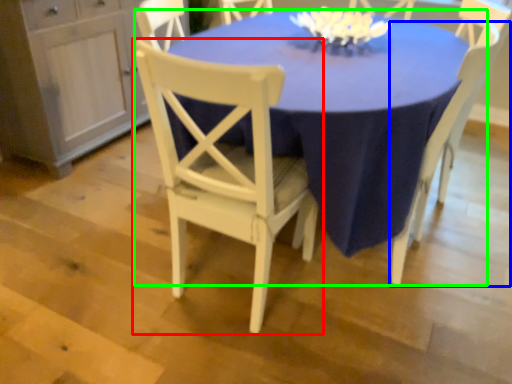
Question: Which object is positioned farthest from chair (highlighted by a red box)? Select from chair (highlighted by a blue box) and table (highlighted by a green box).

Choices:
 (A) chair
 (B) table

Answer: (A)